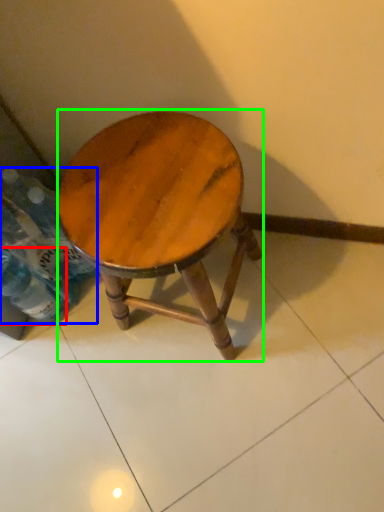
Question: Estimate the real-world distances between objects in this image. Which object is closer to bottle (highlighted by a red box), bottle (highlighted by a blue box) or stool (highlighted by a green box)?

Choices:
 (A) bottle
 (B) stool

Answer: (A)